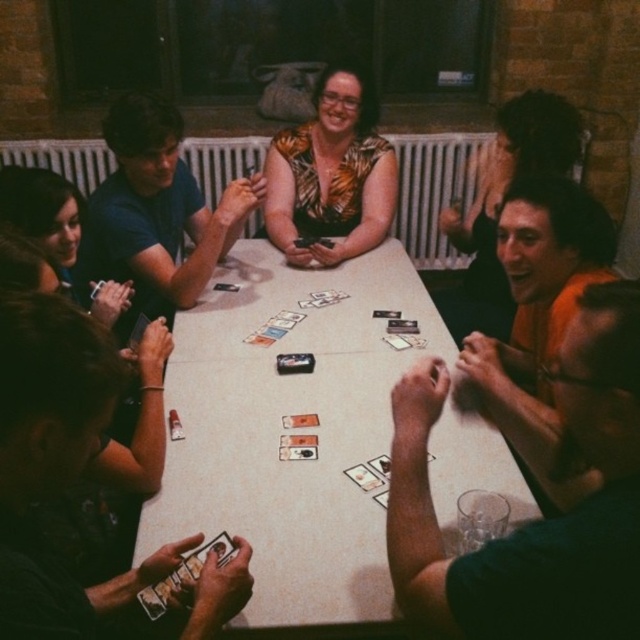
Which is more to the left, white glossy table at center or printed fabric blouse at center?

From the viewer's perspective, white glossy table at center appears more on the left side.

Identify the location of white glossy table at center. This screenshot has height=640, width=640. (292, 435).